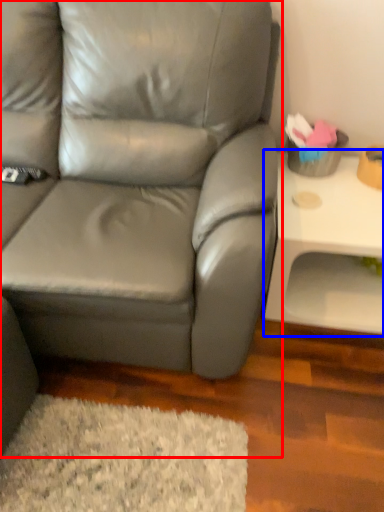
Question: Which of the following is the farthest to the observer, studio couch (highlighted by a red box) or table (highlighted by a blue box)?

Choices:
 (A) studio couch
 (B) table

Answer: (B)